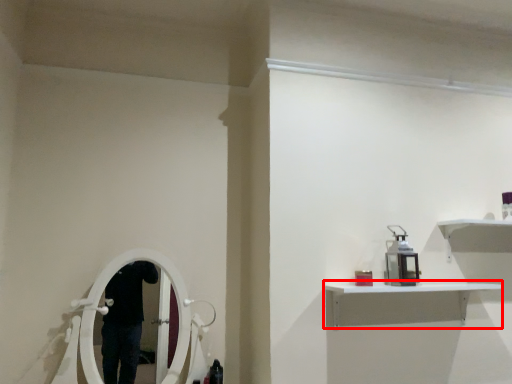
Question: In this image, where is shelf (annotated by the red box) located relative to equipment?

Choices:
 (A) left
 (B) right

Answer: (B)